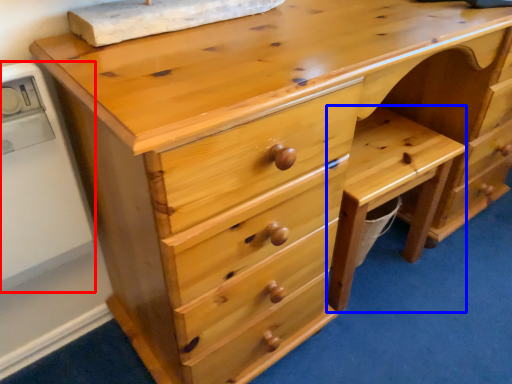
Question: Which object is further to the camera taking this photo, appliance (highlighted by a red box) or cabinetry (highlighted by a blue box)?

Choices:
 (A) appliance
 (B) cabinetry

Answer: (B)